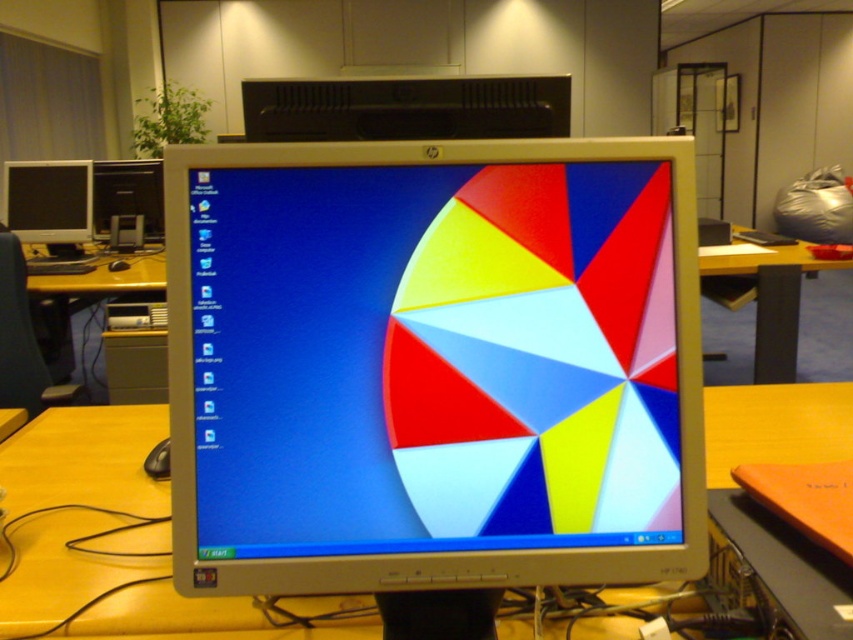
Consider the image. Is matte plastic monitor at center in front of matte black monitor at left?

Yes.

Who is higher up, matte plastic monitor at center or matte black monitor at left?

matte black monitor at left is higher up.

Which is in front, point (589, 332) or point (38, 186)?

Positioned in front is point (589, 332).

At what (x,y) coordinates should I click in order to perform the action: click on matte plastic monitor at center. Please return your answer as a coordinate pair (x, y). Looking at the image, I should click on (432, 356).

Is black plastic speaker at upper center further to the viewer compared to matte black monitor at left?

No.

Is point (488, 93) positioned before point (51, 244)?

Yes, point (488, 93) is closer to viewer.

Does point (376, 92) lie behind point (16, 208)?

No, it is in front of (16, 208).

You are a GUI agent. You are given a task and a screenshot of the screen. Output one action in this format:
    pyautogui.click(x=<x>, y=<y>)
    Task: Click on the black plastic speaker at upper center
    
    Given the screenshot: What is the action you would take?
    pyautogui.click(x=405, y=108)

Which is below, wooden at center or black plastic speaker at upper center?

Positioned lower is wooden at center.

Who is taller, wooden at center or black plastic speaker at upper center?

Standing taller between the two is wooden at center.

Image resolution: width=853 pixels, height=640 pixels. What are the coordinates of `wooden at center` in the screenshot? It's located at (84, 460).

This screenshot has height=640, width=853. Identify the location of wooden at center. (84, 460).